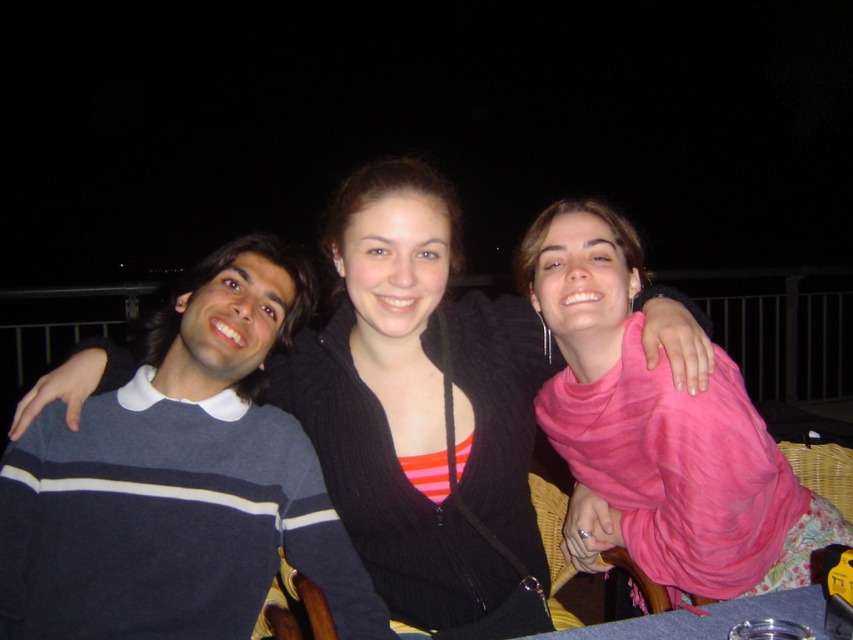
Question: Which point is closer to the camera?

Choices:
 (A) (256, 513)
 (B) (374, 262)
 (C) (695, 428)

Answer: (B)

Question: Can you confirm if dark blue striped sweater at left is smaller than black knit sweater at center?

Choices:
 (A) yes
 (B) no

Answer: (A)

Question: Among these objects, which one is nearest to the camera?

Choices:
 (A) dark blue striped sweater at left
 (B) black knit sweater at center

Answer: (A)

Question: Does dark blue striped sweater at left appear on the right side of black knit sweater at center?

Choices:
 (A) yes
 (B) no

Answer: (B)

Question: Does dark blue striped sweater at left have a smaller size compared to pink fabric scarf at upper right?

Choices:
 (A) yes
 (B) no

Answer: (A)

Question: Considering the real-world distances, which object is closest to the black knit sweater at center?

Choices:
 (A) pink fabric scarf at upper right
 (B) dark blue striped sweater at left

Answer: (A)